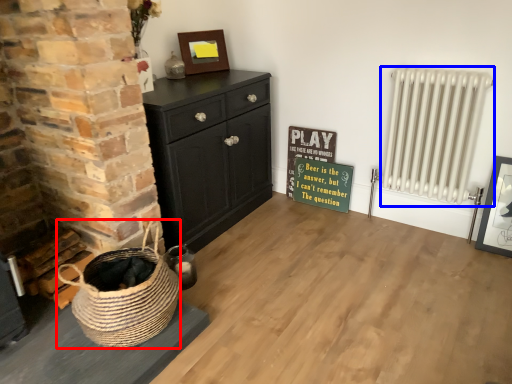
Question: Which object appears farthest to the camera in this image, basket (highlighted by a red box) or radiator (highlighted by a blue box)?

Choices:
 (A) basket
 (B) radiator

Answer: (B)